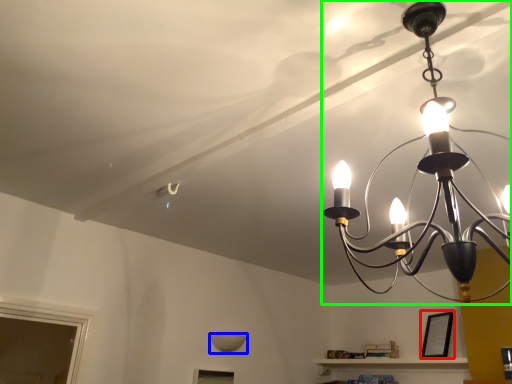
Question: Which object is the closest to the picture frame (highlighted by a red box)? Choose among these: lamp (highlighted by a blue box) or lamp (highlighted by a green box).

Choices:
 (A) lamp
 (B) lamp

Answer: (A)